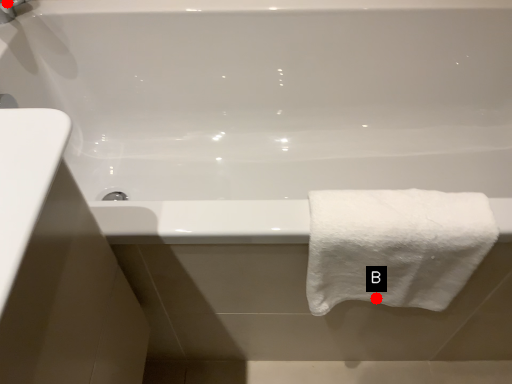
Question: Two points are circled on the image, labeled by A and B beside each circle. Among these points, which one is farthest from the camera?

Choices:
 (A) A is further
 (B) B is further

Answer: (A)